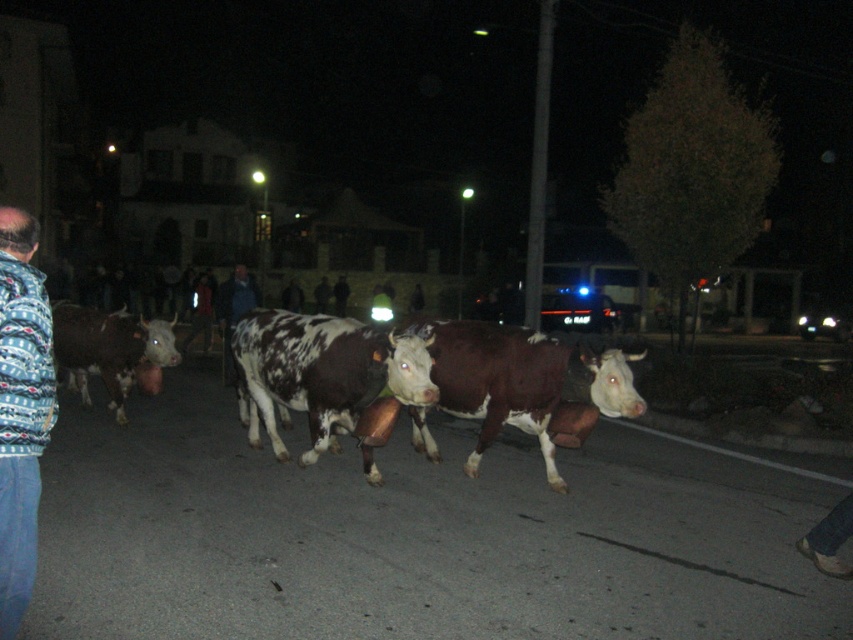
Question: Which point appears farthest from the camera in this image?

Choices:
 (A) (598, 387)
 (B) (84, 317)
 (C) (251, 396)
 (D) (13, 436)

Answer: (B)

Question: Among these points, which one is nearest to the camera?

Choices:
 (A) click(30, 243)
 (B) click(335, 336)
 (C) click(486, 339)

Answer: (A)

Question: Is brown smooth cow at center thinner than brown speckled cow at left?

Choices:
 (A) yes
 (B) no

Answer: (A)

Question: Can you confirm if speckled fur bull at center is wider than brown speckled cow at left?

Choices:
 (A) yes
 (B) no

Answer: (B)

Question: Is brown smooth cow at center above speckled fur bull at center?

Choices:
 (A) no
 (B) yes

Answer: (A)

Question: Estimate the real-world distances between objects in this image. Which object is farther from the brown speckled cow at left?

Choices:
 (A) brown smooth cow at center
 (B) brushed metal jacket at left

Answer: (B)